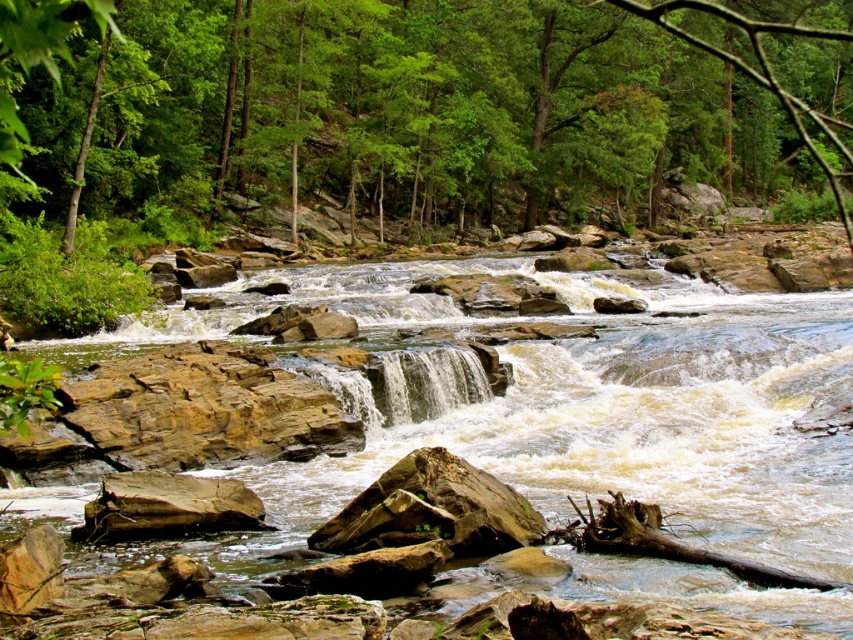
You are a hiker standing at the edge of the forest. You see the green leafy tree at upper center and the brown rocky stream at center. Which object is taller?

The green leafy tree at upper center is much taller than the brown rocky stream at center.

In the scene shown: You are a hiker trying to cross the brown rocky stream at center. There is a green leafy tree at upper center nearby. Which object would you use for shade and why?

The green leafy tree at upper center would provide better shade because it is larger in size than the brown rocky stream at center.

You are a bird flying over the forest and see the point marked at coordinates (415, 104). Which object in the scene does this point lie on?

The point marked at coordinates (415, 104) lies on the green leafy tree at upper center.